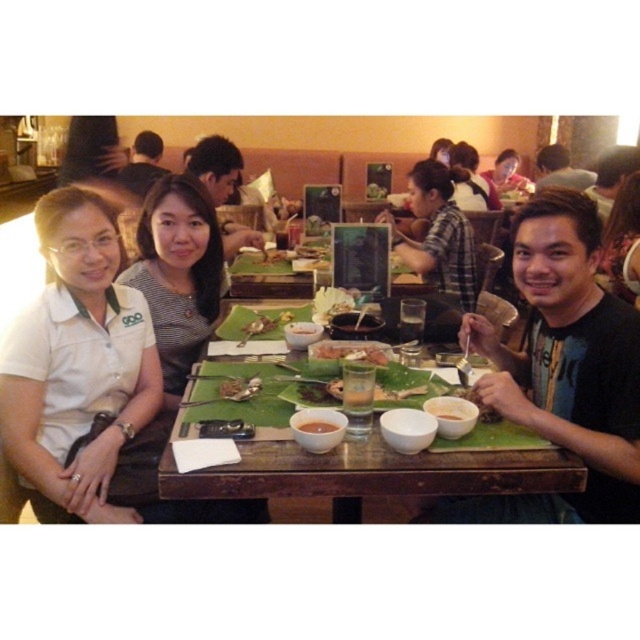
Between white matte shirt at upper left and dark brown hair at upper left, which one appears on the right side from the viewer's perspective?

white matte shirt at upper left is more to the right.

Is white matte shirt at upper left taller than dark brown hair at upper left?

Yes, white matte shirt at upper left is taller than dark brown hair at upper left.

Where is `white matte shirt at upper left`? white matte shirt at upper left is located at coordinates (76, 364).

Find the location of a particular element. The image size is (640, 640). brown matte meat at center is located at coordinates (349, 352).

The width and height of the screenshot is (640, 640). Describe the element at coordinates (349, 352) in the screenshot. I see `brown matte meat at center` at that location.

At what (x,y) coordinates should I click in order to perform the action: click on brown matte meat at center. Please return your answer as a coordinate pair (x, y). Looking at the image, I should click on (349, 352).

Consider the image. Is brown matte meat at center bigger than matte pink shirt at upper center?

No, brown matte meat at center is not bigger than matte pink shirt at upper center.

Is point (324, 340) less distant than point (502, 176)?

Yes, it is.

The height and width of the screenshot is (640, 640). Find the location of `brown matte meat at center`. brown matte meat at center is located at coordinates (349, 352).